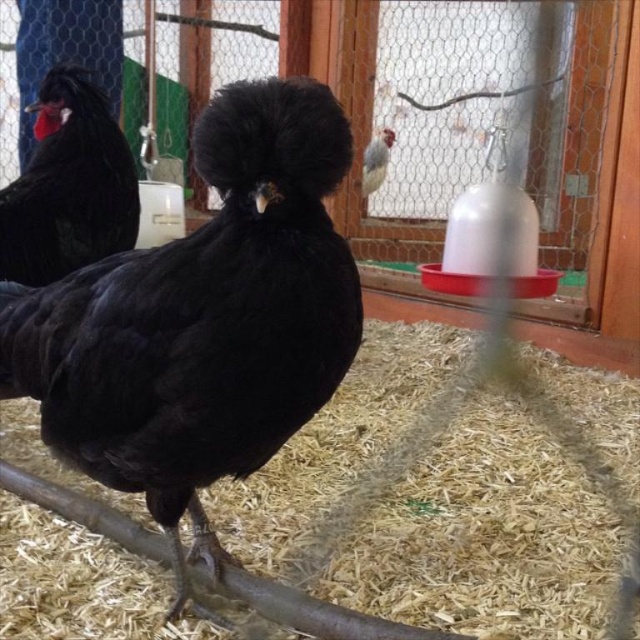
Question: Which of these objects is positioned closest to the black feathered chicken at center?

Choices:
 (A) matte black chicken at left
 (B) speckled feathered chicken at upper center
 (C) brown shredded hay at center

Answer: (C)

Question: Among these points, which one is farthest from the camera?

Choices:
 (A) (385, 156)
 (B) (314, 456)
 (C) (35, 160)
 (D) (58, 300)

Answer: (A)

Question: Does black feathered chicken at center appear on the left side of matte black chicken at left?

Choices:
 (A) yes
 (B) no

Answer: (B)

Question: Is brown shredded hay at center bigger than matte black chicken at left?

Choices:
 (A) yes
 (B) no

Answer: (A)

Question: Can you confirm if black feathered chicken at center is smaller than speckled feathered chicken at upper center?

Choices:
 (A) no
 (B) yes

Answer: (A)

Question: Estimate the real-world distances between objects in this image. Which object is farther from the matte black chicken at left?

Choices:
 (A) black feathered chicken at center
 (B) speckled feathered chicken at upper center

Answer: (B)